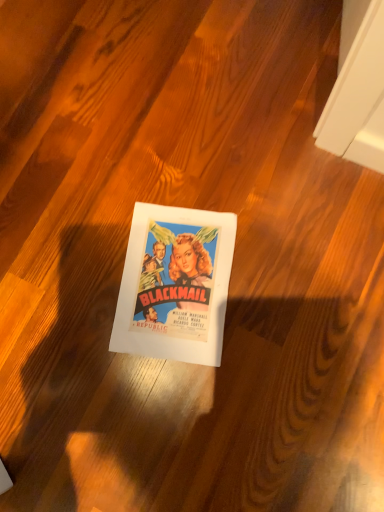
Where is `free spot in front of white paper poster at center`? free spot in front of white paper poster at center is located at coordinates (206, 412).